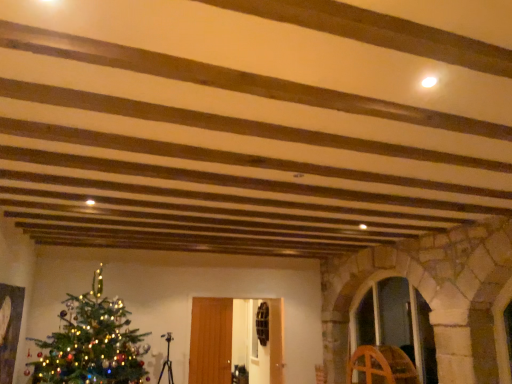
Question: Is transparent glass door at center, acting as the second glass door starting from the right, oriented towards wooden wheel at right?

Choices:
 (A) no
 (B) yes

Answer: (A)

Question: Does transparent glass door at center, the first glass door viewed from the left, have a greater width compared to wooden wheel at right?

Choices:
 (A) no
 (B) yes

Answer: (A)

Question: Can you confirm if transparent glass door at center, acting as the second glass door starting from the right, is taller than wooden wheel at right?

Choices:
 (A) yes
 (B) no

Answer: (A)

Question: From a real-world perspective, does transparent glass door at center, the first glass door viewed from the left, sit lower than wooden wheel at right?

Choices:
 (A) yes
 (B) no

Answer: (B)

Question: From the image's perspective, is transparent glass door at center, acting as the second glass door starting from the right, on top of wooden wheel at right?

Choices:
 (A) yes
 (B) no

Answer: (A)

Question: Considering the positions of point (113, 375) and point (390, 365), is point (113, 375) closer or farther from the camera than point (390, 365)?

Choices:
 (A) closer
 (B) farther

Answer: (A)

Question: Considering the positions of green matte christmas tree at lower left and wooden wheel at right in the image, is green matte christmas tree at lower left wider or thinner than wooden wheel at right?

Choices:
 (A) wide
 (B) thin

Answer: (A)

Question: From a real-world perspective, is green matte christmas tree at lower left physically located above or below wooden wheel at right?

Choices:
 (A) above
 (B) below

Answer: (A)

Question: From the image's perspective, is green matte christmas tree at lower left above or below wooden wheel at right?

Choices:
 (A) below
 (B) above

Answer: (B)

Question: Is transparent glass door at center-right, acting as the 2th glass door starting from the left, wider or thinner than green matte christmas tree at lower left?

Choices:
 (A) thin
 (B) wide

Answer: (A)

Question: From a real-world perspective, is transparent glass door at center-right, which appears as the first glass door when viewed from the right, positioned above or below green matte christmas tree at lower left?

Choices:
 (A) below
 (B) above

Answer: (A)

Question: Would you say transparent glass door at center-right, acting as the 2th glass door starting from the left, is to the left or to the right of green matte christmas tree at lower left in the picture?

Choices:
 (A) left
 (B) right

Answer: (B)

Question: From the image's perspective, is transparent glass door at center-right, which appears as the first glass door when viewed from the right, above or below green matte christmas tree at lower left?

Choices:
 (A) above
 (B) below

Answer: (B)

Question: Would you say green matte christmas tree at lower left is inside or outside transparent glass door at center-right, acting as the 2th glass door starting from the left?

Choices:
 (A) inside
 (B) outside

Answer: (B)

Question: Relative to transparent glass door at center-right, which appears as the first glass door when viewed from the right, is green matte christmas tree at lower left in front or behind?

Choices:
 (A) behind
 (B) front

Answer: (B)